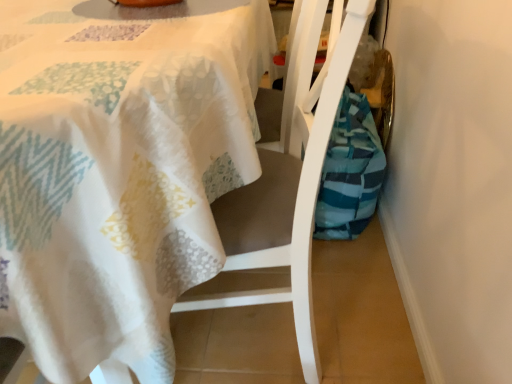
Question: Would you say teal striped fabric bag at lower right is part of white fabric chair at center's contents?

Choices:
 (A) yes
 (B) no

Answer: (B)

Question: Considering the relative sizes of white fabric chair at center and teal striped fabric bag at lower right in the image provided, is white fabric chair at center wider than teal striped fabric bag at lower right?

Choices:
 (A) yes
 (B) no

Answer: (A)

Question: From the image's perspective, is white fabric chair at center above teal striped fabric bag at lower right?

Choices:
 (A) no
 (B) yes

Answer: (A)

Question: Is the position of white fabric chair at center less distant than that of teal striped fabric bag at lower right?

Choices:
 (A) yes
 (B) no

Answer: (A)

Question: Considering the relative positions of white fabric chair at center and teal striped fabric bag at lower right in the image provided, is white fabric chair at center to the left of teal striped fabric bag at lower right from the viewer's perspective?

Choices:
 (A) yes
 (B) no

Answer: (A)

Question: Is the position of white fabric chair at center more distant than that of teal striped fabric bag at lower right?

Choices:
 (A) yes
 (B) no

Answer: (B)

Question: Is teal striped fabric bag at lower right in contact with white fabric chair at center?

Choices:
 (A) no
 (B) yes

Answer: (A)

Question: Could you tell me if teal striped fabric bag at lower right is facing white fabric chair at center?

Choices:
 (A) no
 (B) yes

Answer: (A)

Question: Can you confirm if teal striped fabric bag at lower right is wider than white fabric chair at center?

Choices:
 (A) no
 (B) yes

Answer: (A)

Question: Would you say teal striped fabric bag at lower right is outside white fabric chair at center?

Choices:
 (A) no
 (B) yes

Answer: (B)

Question: From the image's perspective, does teal striped fabric bag at lower right appear lower than white fabric chair at center?

Choices:
 (A) yes
 (B) no

Answer: (B)

Question: Is teal striped fabric bag at lower right at the right side of white fabric chair at center?

Choices:
 (A) no
 (B) yes

Answer: (B)

Question: Is white fabric chair at center located within white textured tablecloth at upper left?

Choices:
 (A) no
 (B) yes

Answer: (B)